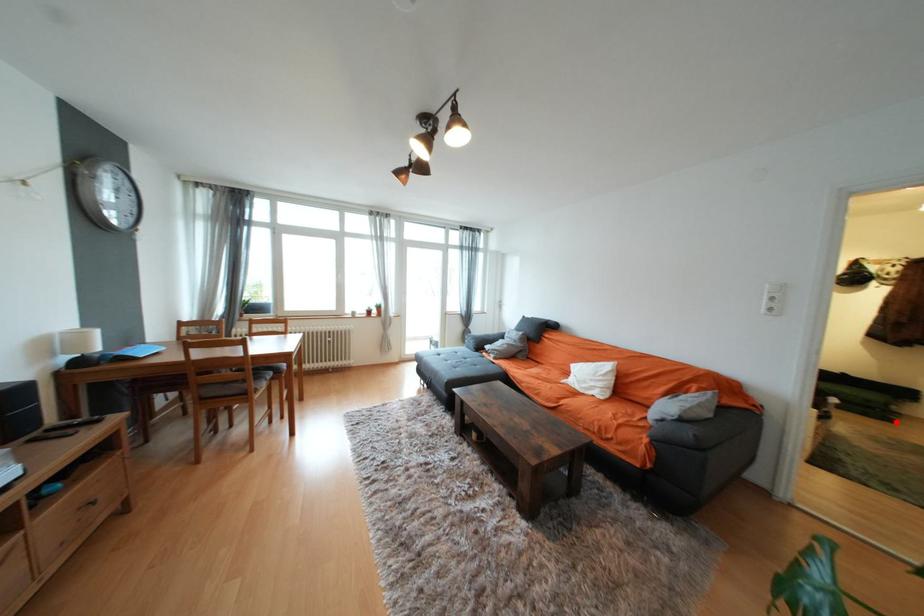
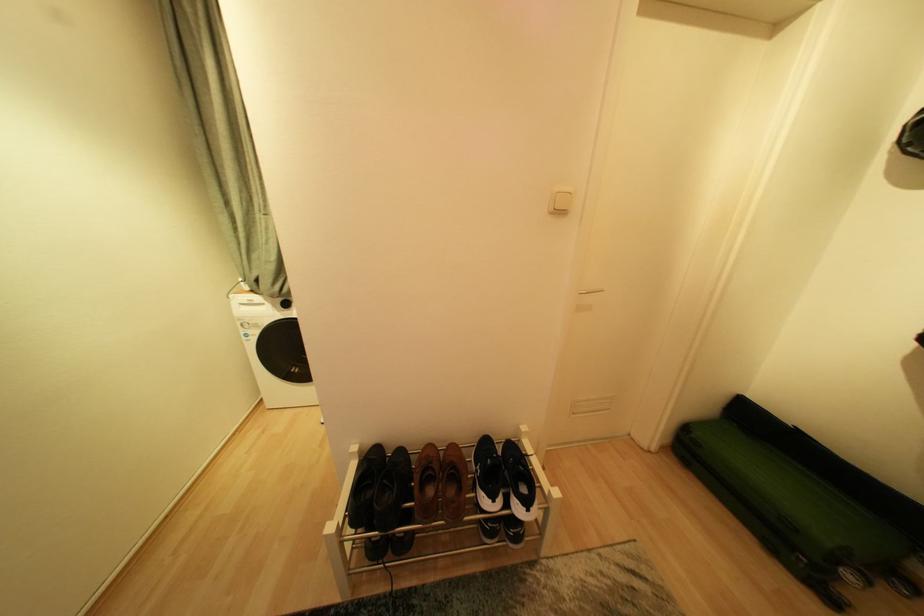
In the second image, find the point that corresponds to the highlighted location in the first image.

(834, 599)